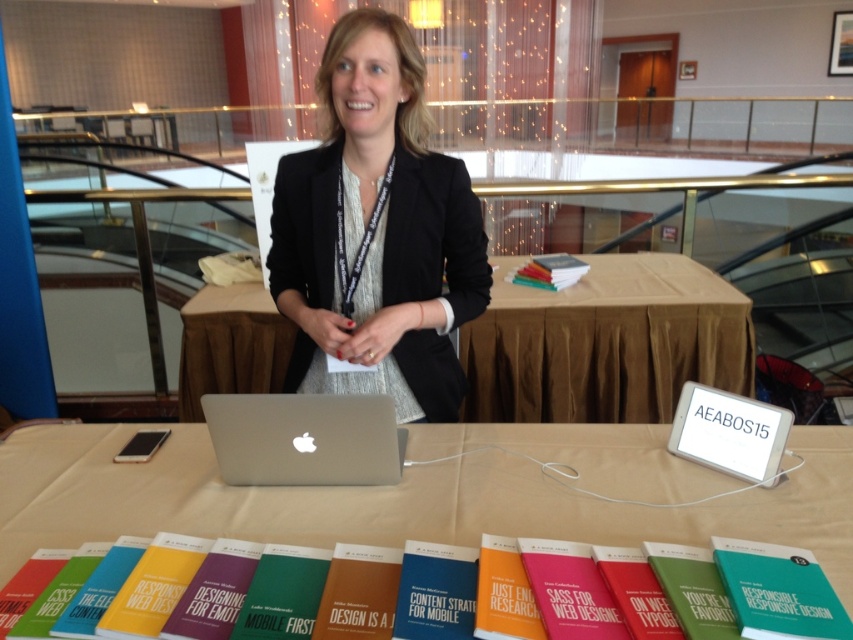
Between brown fabric table at center and blue hardcover book at center, which one appears on the left side from the viewer's perspective?

blue hardcover book at center is more to the left.

Which is in front, point (717, 301) or point (424, 582)?

Point (424, 582) is in front.

The width and height of the screenshot is (853, 640). I want to click on brown fabric table at center, so click(606, 342).

Is black textured blazer at center shorter than green matte book at lower right?

No.

Which of these two, black textured blazer at center or green matte book at lower right, stands shorter?

green matte book at lower right is shorter.

Image resolution: width=853 pixels, height=640 pixels. Describe the element at coordinates (376, 230) in the screenshot. I see `black textured blazer at center` at that location.

This screenshot has width=853, height=640. In order to click on black textured blazer at center in this screenshot , I will do coord(376,230).

Measure the distance from green matte book at lower center to green matte book at lower right.

They are 8.73 inches apart.

Does green matte book at lower center have a greater height compared to green matte book at lower right?

No, green matte book at lower center is not taller than green matte book at lower right.

Does point (761, 596) come closer to viewer compared to point (834, 595)?

Yes.

The image size is (853, 640). In order to click on green matte book at lower center in this screenshot , I will do `click(523, 592)`.